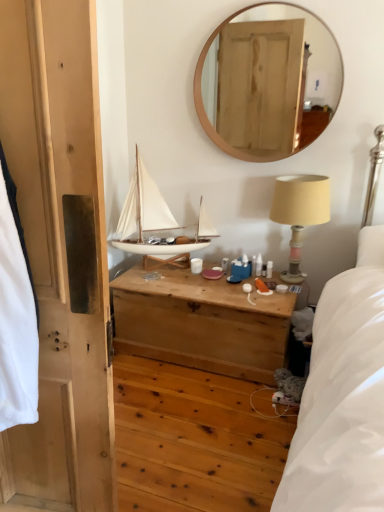
Question: Choose the correct answer: Is beige fabric-covered lampshade at upper right inside white matte sailboat at center or outside it?

Choices:
 (A) outside
 (B) inside

Answer: (A)

Question: From a real-world perspective, is beige fabric-covered lampshade at upper right positioned above or below white matte sailboat at center?

Choices:
 (A) above
 (B) below

Answer: (B)

Question: Which object is positioned farthest from the wooden chest at center?

Choices:
 (A) beige fabric-covered lampshade at upper right
 (B) wooden mirror at upper center
 (C) wooden door at left
 (D) white matte sailboat at center

Answer: (B)

Question: Estimate the real-world distances between objects in this image. Which object is closer to the wooden mirror at upper center?

Choices:
 (A) white matte sailboat at center
 (B) beige fabric-covered lampshade at upper right
 (C) wooden door at left
 (D) wooden chest at center

Answer: (A)